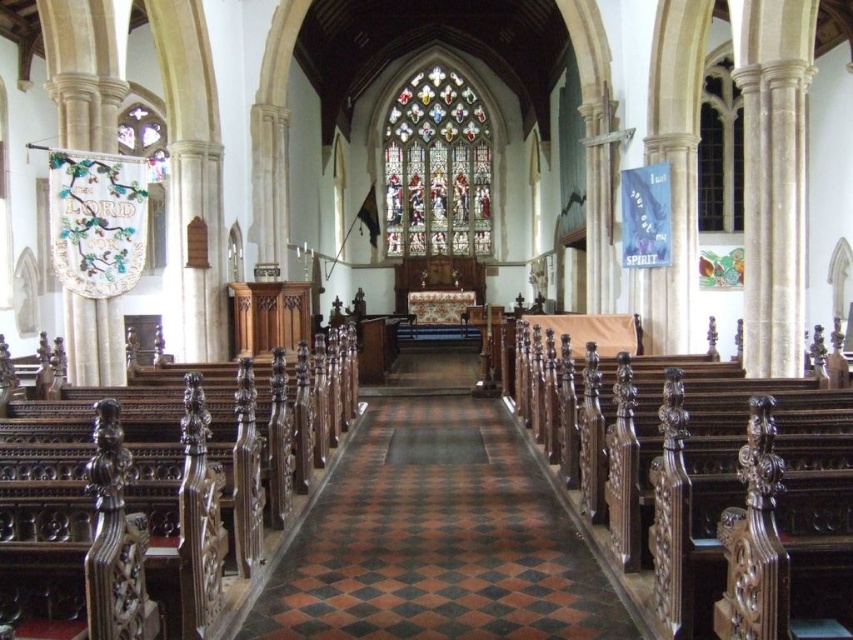
In the scene shown: You are standing at the entrance of the church and want to walk directly towards the stained glass window at center. Which direction should you walk relative to the brown polished wood aisle at center?

You should walk to the right of the brown polished wood aisle at center because the stained glass window at center is to the right of the brown polished wood aisle at center.